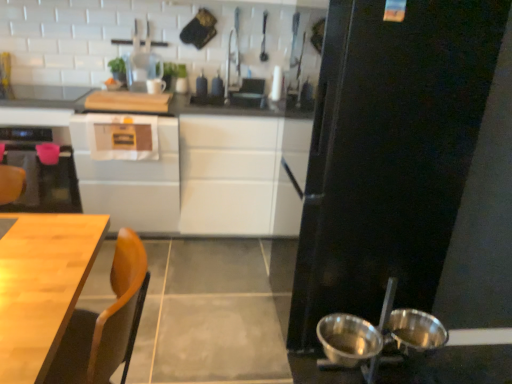
In order to face white glossy countertop at upper left, should I rotate leftwards or rightwards?

To face it directly, rotate left by 26.332 degrees.

The width and height of the screenshot is (512, 384). Describe the element at coordinates (390, 153) in the screenshot. I see `black matte refrigerator at right` at that location.

In order to face white glossy cabinet at center, placed as the first cabinetry when sorted from right to left, should I rotate leftwards or rightwards?

To align with it, rotate left about 12.940°.

This screenshot has width=512, height=384. I want to click on white glossy cabinet at center, placed as the first cabinetry when sorted from left to right, so click(129, 169).

Does point (3, 258) come behind point (124, 161)?

No, (3, 258) is in front of (124, 161).

Considering the sizes of wooden table at lower left and white glossy cabinet at center, placed as the first cabinetry when sorted from left to right, in the image, is wooden table at lower left wider or thinner than white glossy cabinet at center, placed as the first cabinetry when sorted from left to right,?

Clearly, wooden table at lower left has less width compared to white glossy cabinet at center, placed as the first cabinetry when sorted from left to right.

Does wooden table at lower left have a lesser height compared to white glossy cabinet at center, placed as the first cabinetry when sorted from left to right?

Indeed, wooden table at lower left has a lesser height compared to white glossy cabinet at center, placed as the first cabinetry when sorted from left to right.

Can you see wooden table at lower left touching white glossy cabinet at center, which is the 2th cabinetry in right-to-left order?

They are not placed beside each other.

In the scene shown: Is white glossy cabinet at center, positioned as the second cabinetry in left-to-right order, to the right of white glossy countertop at upper left from the viewer's perspective?

Indeed, white glossy cabinet at center, positioned as the second cabinetry in left-to-right order, is positioned on the right side of white glossy countertop at upper left.

Which of these two, white glossy cabinet at center, positioned as the second cabinetry in left-to-right order, or white glossy countertop at upper left, stands shorter?

white glossy countertop at upper left is shorter.

Is white glossy cabinet at center, placed as the first cabinetry when sorted from right to left, in front of or behind white glossy countertop at upper left in the image?

Visually, white glossy cabinet at center, placed as the first cabinetry when sorted from right to left, is located in front of white glossy countertop at upper left.

From the picture: Considering the sizes of black matte refrigerator at right and wooden table at lower left in the image, is black matte refrigerator at right wider or thinner than wooden table at lower left?

Considering their sizes, black matte refrigerator at right looks broader than wooden table at lower left.

From a real-world perspective, is black matte refrigerator at right above or below wooden table at lower left?

black matte refrigerator at right is situated higher than wooden table at lower left in the real world.

Considering the sizes of black matte refrigerator at right and wooden table at lower left in the image, is black matte refrigerator at right bigger or smaller than wooden table at lower left?

Considering their sizes, black matte refrigerator at right takes up more space than wooden table at lower left.

In the scene shown: Can you tell me how much black matte refrigerator at right and shiny metallic bowls at lower right, arranged as the second bowl when viewed from the left, differ in facing direction?

The angle between the facing direction of black matte refrigerator at right and the facing direction of shiny metallic bowls at lower right, arranged as the second bowl when viewed from the left, is 91.9 degrees.

From the image's perspective, would you say black matte refrigerator at right is positioned over shiny metallic bowls at lower right, the first bowl in the right-to-left sequence?

Yes, from the image's perspective, black matte refrigerator at right is on top of shiny metallic bowls at lower right, the first bowl in the right-to-left sequence.

Considering the positions of points (438, 113) and (391, 334), is point (438, 113) closer to camera compared to point (391, 334)?

Yes, it is.

Is black matte refrigerator at right spatially inside shiny metallic bowls at lower right, the first bowl in the right-to-left sequence, or outside of it?

black matte refrigerator at right is spatially situated outside shiny metallic bowls at lower right, the first bowl in the right-to-left sequence.

Is shiny metallic bowls at lower right, the first bowl in the right-to-left sequence, bigger than wooden table at lower left?

No.

Image resolution: width=512 pixels, height=384 pixels. What are the coordinates of `table above the shiny metallic bowls at lower right, the first bowl in the right-to-left sequence (from a real-world perspective)` in the screenshot? It's located at (42, 286).

Is shiny metallic bowls at lower right, arranged as the second bowl when viewed from the left, shorter than wooden table at lower left?

Correct, shiny metallic bowls at lower right, arranged as the second bowl when viewed from the left, is not as tall as wooden table at lower left.

From a real-world perspective, which object stands above the other?

wooden table at lower left is physically above.

Between black matte refrigerator at right and white glossy countertop at upper left, which one has less height?

Standing shorter between the two is white glossy countertop at upper left.

Between black matte refrigerator at right and white glossy countertop at upper left, which one has smaller width?

With smaller width is white glossy countertop at upper left.

Which point is more distant from viewer, (400, 161) or (62, 96)?

The point (62, 96) is behind.

Is shiny metallic bowls at lower right, the first bowl in the right-to-left sequence, positioned far away from white glossy cabinet at center, positioned as the second cabinetry in left-to-right order?

That's right, there is a large distance between shiny metallic bowls at lower right, the first bowl in the right-to-left sequence, and white glossy cabinet at center, positioned as the second cabinetry in left-to-right order.

In the scene shown: Does shiny metallic bowls at lower right, arranged as the second bowl when viewed from the left, turn towards white glossy cabinet at center, positioned as the second cabinetry in left-to-right order?

No, shiny metallic bowls at lower right, arranged as the second bowl when viewed from the left, is not oriented towards white glossy cabinet at center, positioned as the second cabinetry in left-to-right order.

Is point (401, 346) closer or farther from the camera than point (230, 158)?

Point (401, 346) appears to be closer to the viewer than point (230, 158).

Considering the relative positions of shiny metallic bowls at lower right, the first bowl in the right-to-left sequence, and white glossy cabinet at center, placed as the first cabinetry when sorted from right to left, in the image provided, is shiny metallic bowls at lower right, the first bowl in the right-to-left sequence, to the right of white glossy cabinet at center, placed as the first cabinetry when sorted from right to left, from the viewer's perspective?

Yes.

The width and height of the screenshot is (512, 384). Find the location of `table above the white glossy cabinet at center, which is the 2th cabinetry in right-to-left order (from a real-world perspective)`. table above the white glossy cabinet at center, which is the 2th cabinetry in right-to-left order (from a real-world perspective) is located at coordinates (42, 286).

Image resolution: width=512 pixels, height=384 pixels. In order to click on cabinetry that is the 1st object located below the white glossy countertop at upper left (from the image's perspective) in this screenshot , I will do [183, 169].

Which object lies nearer to the anchor point metallic silver bowl at lower right, which appears as the 1th bowl when viewed from the left, wooden table at lower left or white glossy cabinet at center, which is the 2th cabinetry in right-to-left order?

wooden table at lower left lies closer to metallic silver bowl at lower right, which appears as the 1th bowl when viewed from the left, than the other object.

Looking at the image, which one is located further to white glossy cabinet at center, which is the 2th cabinetry in right-to-left order, black matte refrigerator at right or white glossy cabinet at center, positioned as the second cabinetry in left-to-right order?

black matte refrigerator at right.

When comparing their distances from white glossy cabinet at center, positioned as the second cabinetry in left-to-right order, does white glossy countertop at upper left or white glossy cabinet at center, placed as the first cabinetry when sorted from left to right, seem further?

white glossy countertop at upper left is further to white glossy cabinet at center, positioned as the second cabinetry in left-to-right order.

Estimate the real-world distances between objects in this image. Which object is closer to metallic silver bowl at lower right, which appears as the 1th bowl when viewed from the left, white glossy cabinet at center, placed as the first cabinetry when sorted from right to left, or black matte refrigerator at right?

black matte refrigerator at right.

Looking at the image, which one is located further to black matte refrigerator at right, white glossy cabinet at center, positioned as the second cabinetry in left-to-right order, or metallic silver bowl at lower right, which appears as the 1th bowl when viewed from the left?

white glossy cabinet at center, positioned as the second cabinetry in left-to-right order, lies further to black matte refrigerator at right than the other object.

Which object lies further to the anchor point black matte refrigerator at right, wooden table at lower left or white glossy cabinet at center, positioned as the second cabinetry in left-to-right order?

The object further to black matte refrigerator at right is wooden table at lower left.

Estimate the real-world distances between objects in this image. Which object is further from white glossy countertop at upper left, shiny metallic bowls at lower right, arranged as the second bowl when viewed from the left, or white glossy cabinet at center, which is the 2th cabinetry in right-to-left order?

shiny metallic bowls at lower right, arranged as the second bowl when viewed from the left, is further to white glossy countertop at upper left.

Based on their spatial positions, is wooden table at lower left or white glossy cabinet at center, which is the 2th cabinetry in right-to-left order, further from white glossy countertop at upper left?

wooden table at lower left is positioned further to the anchor white glossy countertop at upper left.

Find the location of `appliance between wooden table at lower left and shiny metallic bowls at lower right, the first bowl in the right-to-left sequence`. appliance between wooden table at lower left and shiny metallic bowls at lower right, the first bowl in the right-to-left sequence is located at coordinates (390, 153).

This screenshot has height=384, width=512. In order to click on cabinetry located between wooden table at lower left and white glossy cabinet at center, positioned as the second cabinetry in left-to-right order, in the depth direction in this screenshot , I will do `click(129, 169)`.

Where is `cabinetry between white glossy cabinet at center, placed as the first cabinetry when sorted from left to right, and shiny metallic bowls at lower right, arranged as the second bowl when viewed from the left, in the horizontal direction`? The width and height of the screenshot is (512, 384). cabinetry between white glossy cabinet at center, placed as the first cabinetry when sorted from left to right, and shiny metallic bowls at lower right, arranged as the second bowl when viewed from the left, in the horizontal direction is located at coordinates (183, 169).

At what (x,y) coordinates should I click in order to perform the action: click on bowl located between wooden table at lower left and shiny metallic bowls at lower right, the first bowl in the right-to-left sequence, in the left-right direction. Please return your answer as a coordinate pair (x, y). Looking at the image, I should click on (348, 339).